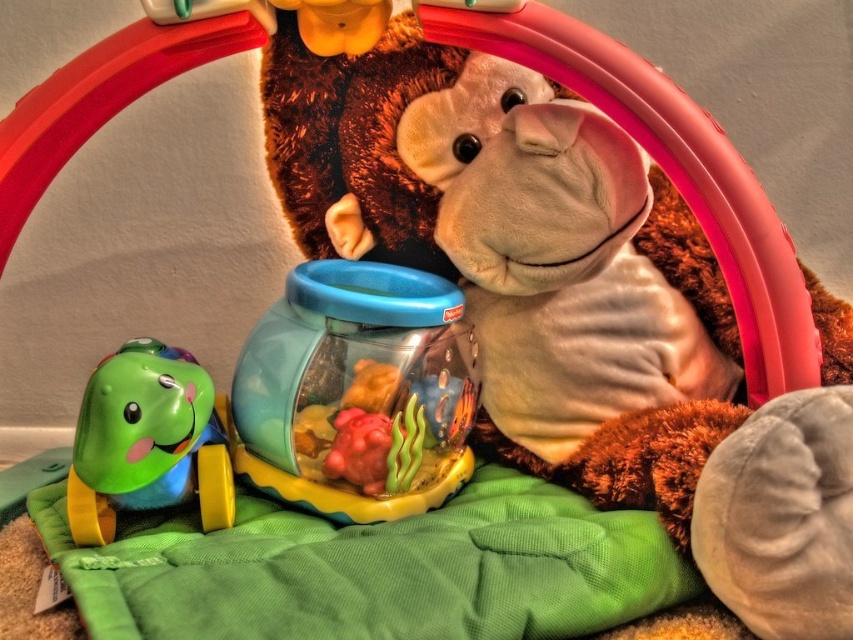
Question: Based on their relative distances, which object is nearer to the translucent plastic toy at center?

Choices:
 (A) fuzzy brown teddy bear at center
 (B) green rubber turtle at lower left

Answer: (B)

Question: Is fuzzy brown teddy bear at center to the right of translucent plastic toy at center from the viewer's perspective?

Choices:
 (A) no
 (B) yes

Answer: (B)

Question: Which is farther from the translucent plastic toy at center?

Choices:
 (A) green rubber turtle at lower left
 (B) fuzzy brown teddy bear at center

Answer: (B)

Question: Does translucent plastic toy at center have a greater width compared to green rubber turtle at lower left?

Choices:
 (A) yes
 (B) no

Answer: (A)

Question: Does translucent plastic toy at center have a lesser width compared to green rubber turtle at lower left?

Choices:
 (A) yes
 (B) no

Answer: (B)

Question: Among these points, which one is farthest from the camera?

Choices:
 (A) (165, 432)
 (B) (376, 436)

Answer: (B)